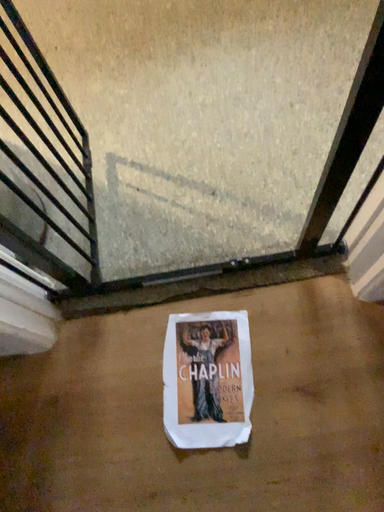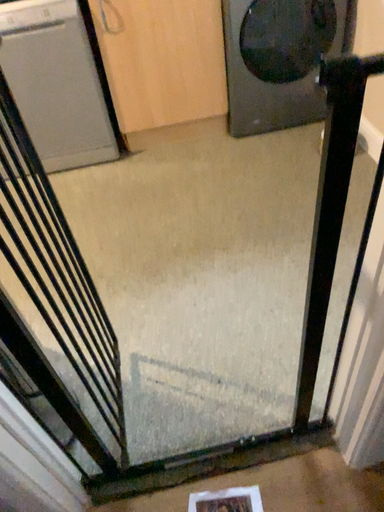
Question: How did the camera likely rotate when shooting the video?

Choices:
 (A) rotated upward
 (B) rotated downward

Answer: (A)